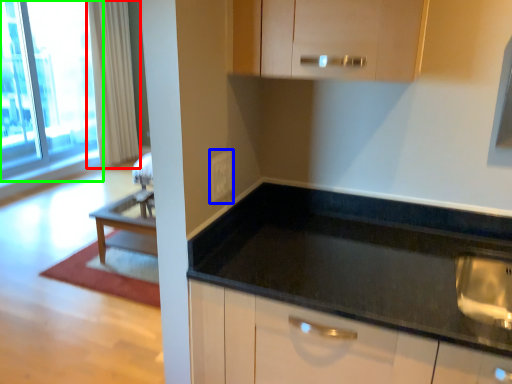
Question: Based on their relative distances, which object is farther from curtain (highlighted by a red box)? Choose from electric outlet (highlighted by a blue box) and window (highlighted by a green box).

Choices:
 (A) electric outlet
 (B) window

Answer: (A)